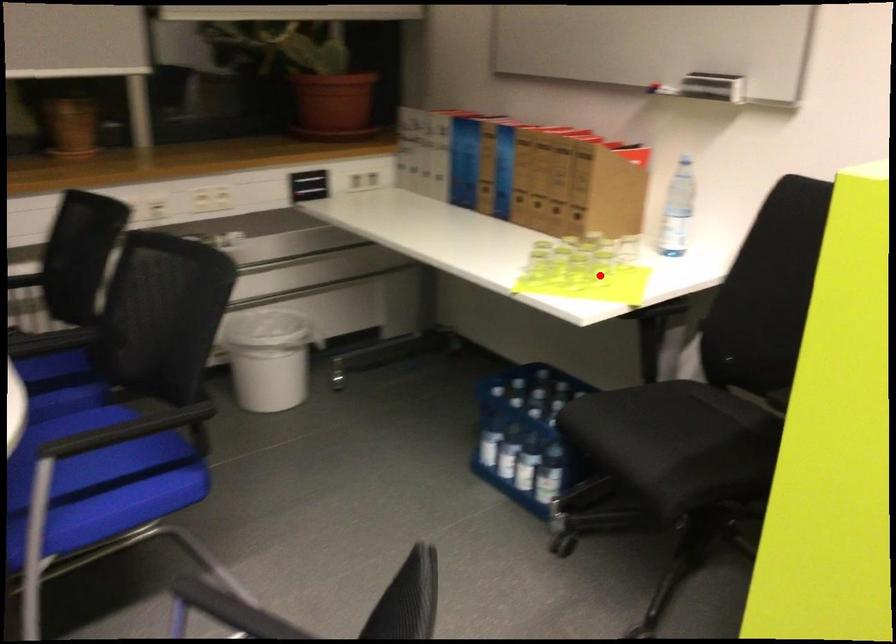
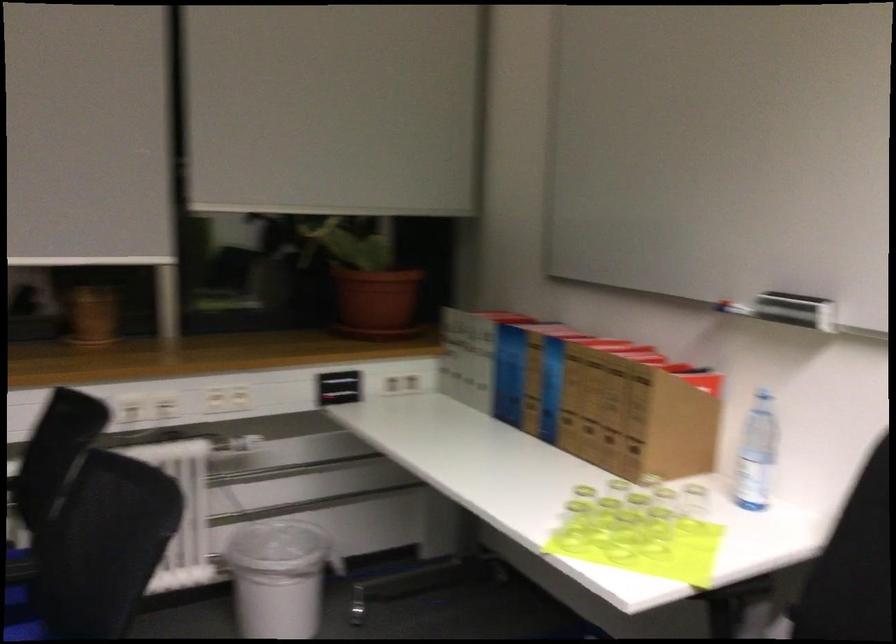
Question: I am providing you with two images of the same scene from different viewpoints. Image1 has a red point marked. In image2, the corresponding 3D location appears at what relative position? Reply with the corresponding letter.

Choices:
 (A) Closer
 (B) Farther

Answer: (A)